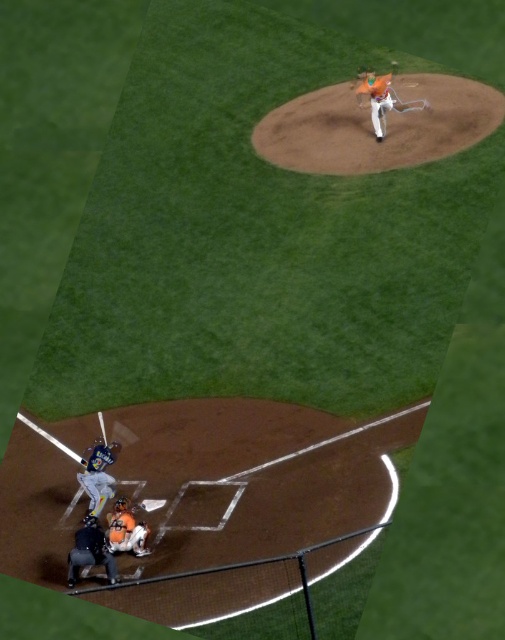
You are a photographer standing at the edge of the infield. You need to capture a clear photo of the orange helmeted umpire at lower left and the metallic bat at lower left. Which object should you focus on first if you want to ensure both are in focus without adjusting your camera settings?

The orange helmeted umpire at lower left is taller than the metallic bat at lower left, so focusing on the umpire first would help ensure both are in focus since it is the larger object in the frame.

You are a baseball player standing at home plate and see the orange helmeted umpire at lower left and the metallic bat at lower left. Which object is closer to you?

The orange helmeted umpire at lower left is bigger than metallic bat at lower left, so the umpire is closer to you.